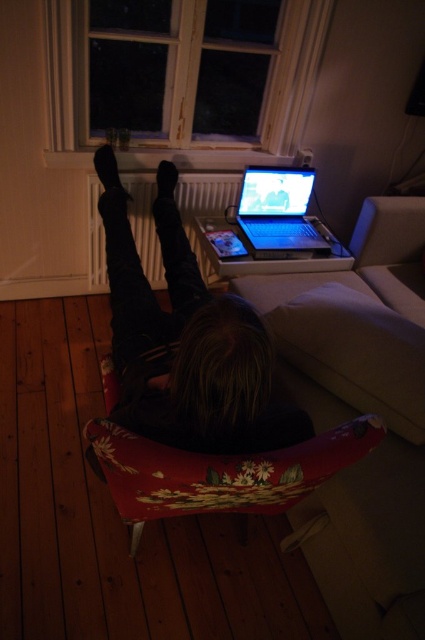
Question: Is white fabric couch at center to the left of dark hair at center from the viewer's perspective?

Choices:
 (A) no
 (B) yes

Answer: (A)

Question: Which is nearer to the white fabric couch at center?

Choices:
 (A) black matte foot at lower center
 (B) dark hair at center

Answer: (B)

Question: Based on their relative distances, which object is farther from the white fabric couch at center?

Choices:
 (A) dark hair at center
 (B) black matte foot at lower center

Answer: (B)

Question: Which object is closer to the camera taking this photo?

Choices:
 (A) white fabric couch at center
 (B) black matte foot at lower center
 (C) shiny silver laptop at center

Answer: (A)

Question: Considering the relative positions of white fabric couch at center and black matte foot at lower center in the image provided, where is white fabric couch at center located with respect to black matte foot at lower center?

Choices:
 (A) above
 (B) below

Answer: (B)

Question: Considering the relative positions of dark hair at center and black matte foot at lower center in the image provided, where is dark hair at center located with respect to black matte foot at lower center?

Choices:
 (A) left
 (B) right

Answer: (B)